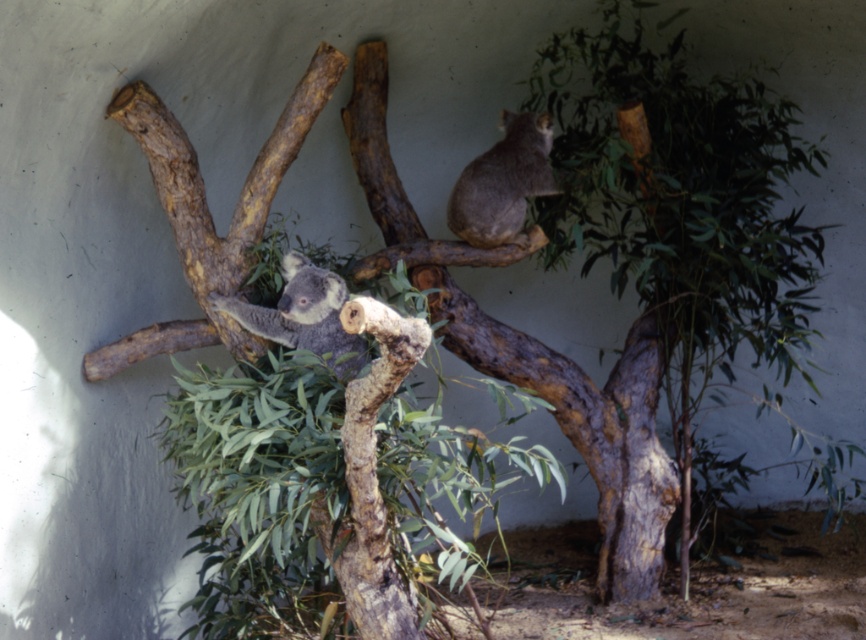
Measure the distance between gray furry koala at upper right and camera.

A distance of 4.92 meters exists between gray furry koala at upper right and camera.

Does gray furry koala at upper right appear on the right side of gray furry koala at center?

Indeed, gray furry koala at upper right is positioned on the right side of gray furry koala at center.

Is point (499, 147) closer to viewer compared to point (359, 342)?

No, (499, 147) is behind (359, 342).

The height and width of the screenshot is (640, 866). In order to click on gray furry koala at upper right in this screenshot , I will do `click(503, 182)`.